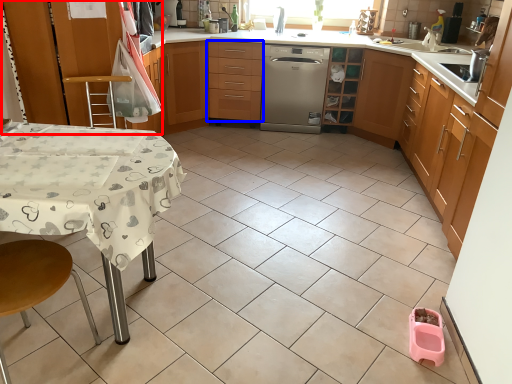
Question: Among these objects, which one is farthest to the camera, cabinetry (highlighted by a red box) or drawer (highlighted by a blue box)?

Choices:
 (A) cabinetry
 (B) drawer

Answer: (B)